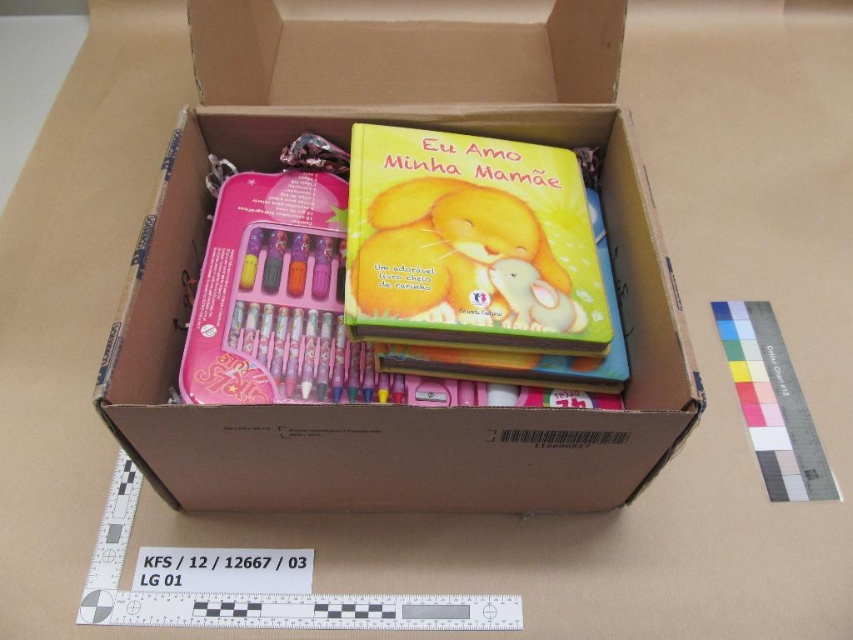
Question: Considering the relative positions of matte cardboard box at center and white plastic ruler at upper right in the image provided, where is matte cardboard box at center located with respect to white plastic ruler at upper right?

Choices:
 (A) above
 (B) below

Answer: (A)

Question: Where is matte cardboard box at center located in relation to white plastic ruler at upper right in the image?

Choices:
 (A) left
 (B) right

Answer: (A)

Question: Which point is closer to the camera taking this photo?

Choices:
 (A) (137, 253)
 (B) (755, 340)

Answer: (A)

Question: Among these points, which one is nearest to the camera?

Choices:
 (A) (244, 116)
 (B) (775, 376)

Answer: (A)

Question: Can you confirm if matte cardboard box at center is bigger than white plastic ruler at upper right?

Choices:
 (A) yes
 (B) no

Answer: (A)